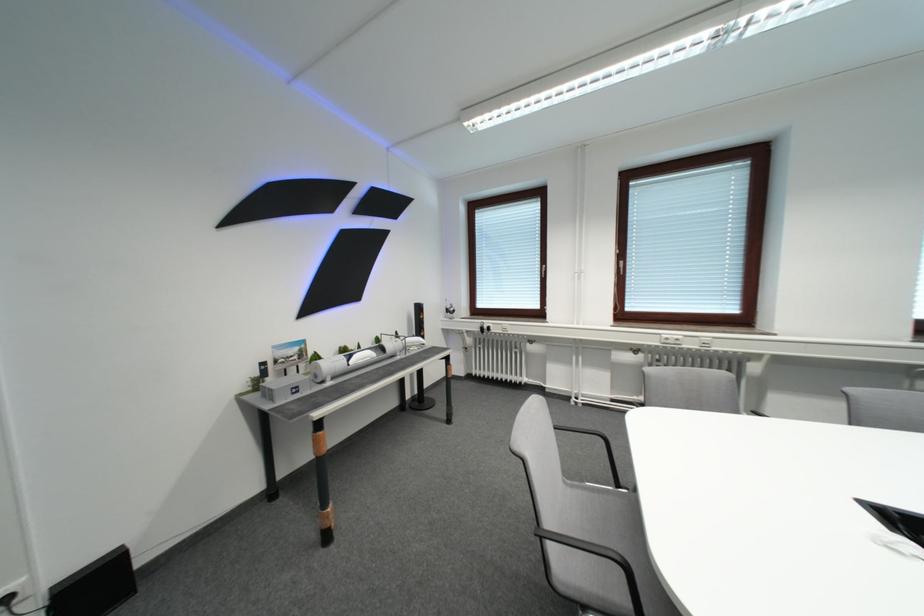
Locate an element on the screen. The width and height of the screenshot is (924, 616). white radiator valve is located at coordinates [529, 342].